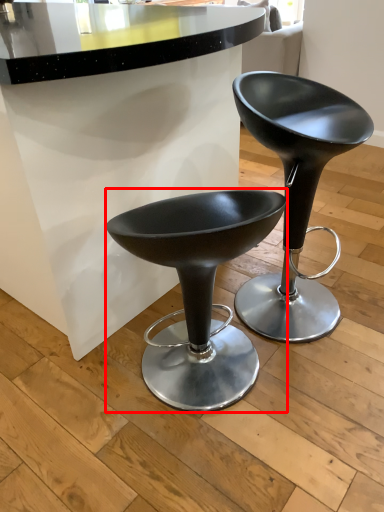
Question: From the image's perspective, considering the relative positions of stool (annotated by the red box) and stool in the image provided, where is stool (annotated by the red box) located with respect to the staircase?

Choices:
 (A) below
 (B) above

Answer: (A)